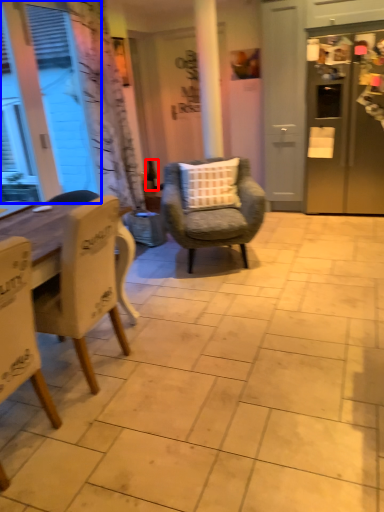
Question: Among these objects, which one is farthest to the camera, bottle (highlighted by a red box) or window screen (highlighted by a blue box)?

Choices:
 (A) bottle
 (B) window screen

Answer: (A)